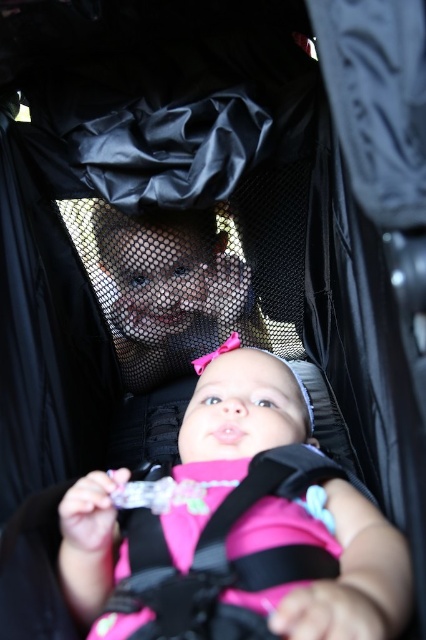
You are a caregiver checking the safety of the stroller. You notice the pink fabric baby at center and the pink fabric strap at center. Which object is taller?

The pink fabric baby at center is taller than the pink fabric strap at center.

You are a photographer trying to capture a candid shot of the baby in the stroller. You notice two points marked in the image. The first point is at coordinate point (221, 474) and the second is at point (242, 573). Which point is closer to the baby?

Point (221, 474) is behind point (242, 573), so the point closer to the baby is point (242, 573).

You are designing a new stroller cover that needs to accommodate both the pink fabric baby at center and the pink fabric strap at center. Based on the scene description, which object requires a wider space in the cover design?

The pink fabric baby at center requires a wider space in the cover design because its width surpasses that of the pink fabric strap at center.